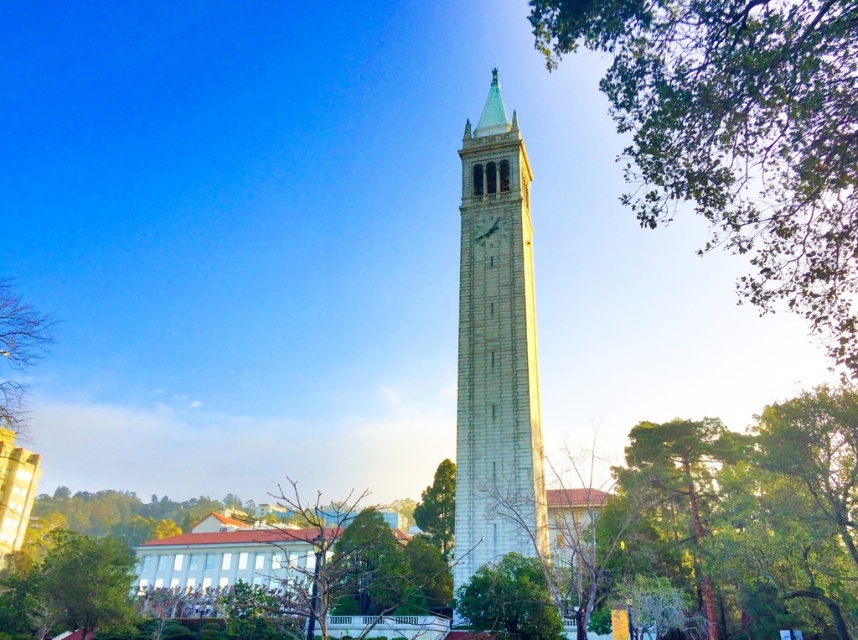
Question: In this image, where is green leafy tree at upper right located relative to white stone clock tower at center?

Choices:
 (A) below
 (B) above

Answer: (B)

Question: Which object appears closest to the camera in this image?

Choices:
 (A) green leafy tree at center
 (B) green leafy tree at lower left
 (C) green leafy tree at upper right
 (D) white stone clock tower at center

Answer: (C)

Question: Which point is closer to the camera taking this photo?

Choices:
 (A) (458, 436)
 (B) (485, 593)

Answer: (B)

Question: Does green leafy tree at lower center have a larger size compared to green leafy tree at center?

Choices:
 (A) yes
 (B) no

Answer: (B)

Question: Does green leafy tree at lower left have a greater width compared to bare branches at left?

Choices:
 (A) no
 (B) yes

Answer: (B)

Question: Which point is closer to the camera?

Choices:
 (A) white stone clock tower at center
 (B) green leafy tree at lower left
 (C) green leafy tree at center

Answer: (A)